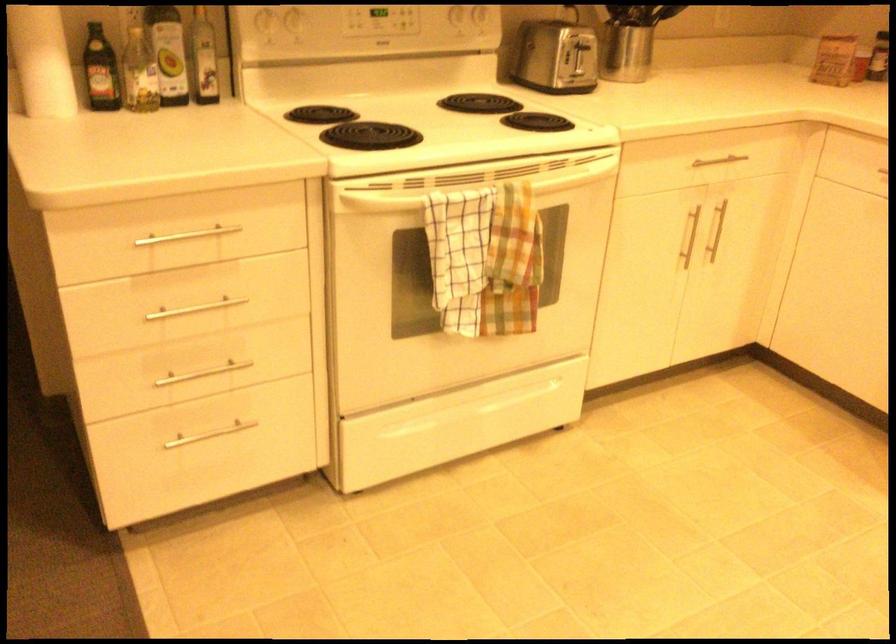
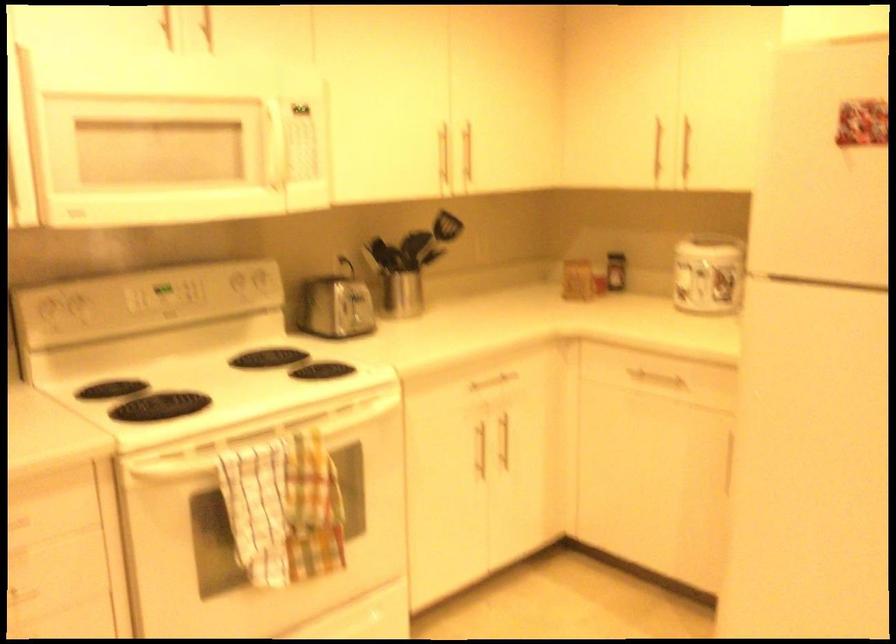
In a continuous first-person perspective shot, in which direction is the camera moving?

The cameraman walked toward right, backward.